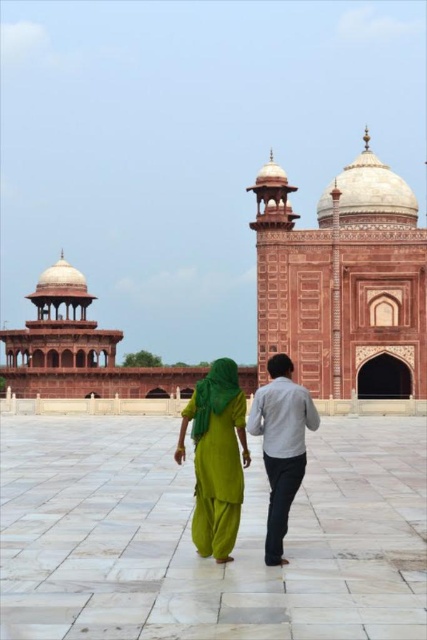
Which is above, marble dome at center or green fabric dress at center?

marble dome at center

Can you confirm if marble dome at center is thinner than green fabric dress at center?

Incorrect, marble dome at center's width is not less than green fabric dress at center's.

Identify the location of marble dome at center. (344, 282).